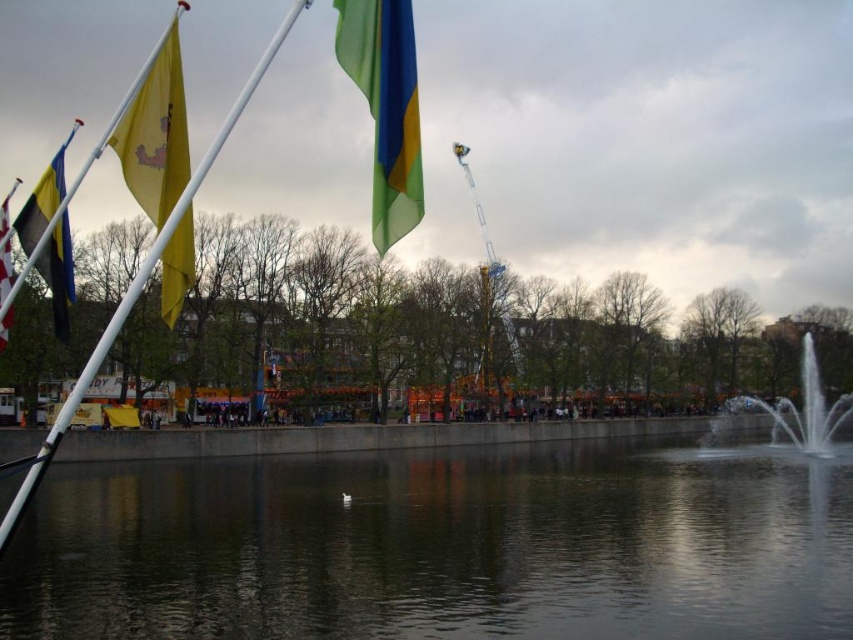
Who is taller, translucent green flag at upper center or blue and yellow fabric flag at left?

With more height is blue and yellow fabric flag at left.

The height and width of the screenshot is (640, 853). In order to click on translucent green flag at upper center in this screenshot , I will do `click(386, 108)`.

You are a GUI agent. You are given a task and a screenshot of the screen. Output one action in this format:
    pyautogui.click(x=<x>, y=<y>)
    Task: Click on the translucent green flag at upper center
    The height and width of the screenshot is (640, 853).
    Given the screenshot: What is the action you would take?
    pyautogui.click(x=386, y=108)

Can you confirm if translucent green flag at upper center is shorter than clear glass fountain at right?

Yes.

Does translucent green flag at upper center lie in front of clear glass fountain at right?

Yes, it is in front of clear glass fountain at right.

Which is behind, point (389, 141) or point (730, 403)?

Point (730, 403)

I want to click on translucent green flag at upper center, so click(386, 108).

Who is positioned more to the left, blue and yellow fabric flag at left or matte black flag at left?

matte black flag at left is more to the left.

Does blue and yellow fabric flag at left appear under matte black flag at left?

No.

Image resolution: width=853 pixels, height=640 pixels. Describe the element at coordinates (57, 273) in the screenshot. I see `blue and yellow fabric flag at left` at that location.

I want to click on blue and yellow fabric flag at left, so click(x=57, y=273).